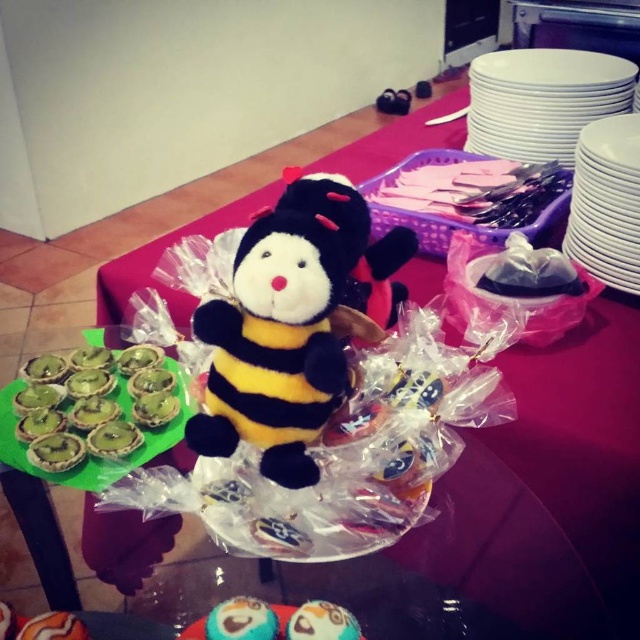
You are a guest at the party and want to grab a treat. The green matte tartlets at center and the smooth chocolate cupcake at center are both on the table. Which one is positioned higher up on the table?

The green matte tartlets at center is located above the smooth chocolate cupcake at center, so it is positioned higher up on the table.

You are planning to place both the green matte tartlets at center and the smooth chocolate cupcake at center on a narrow shelf. Which one requires more horizontal space?

The green matte tartlets at center requires more horizontal space because its width surpasses that of the smooth chocolate cupcake at center.